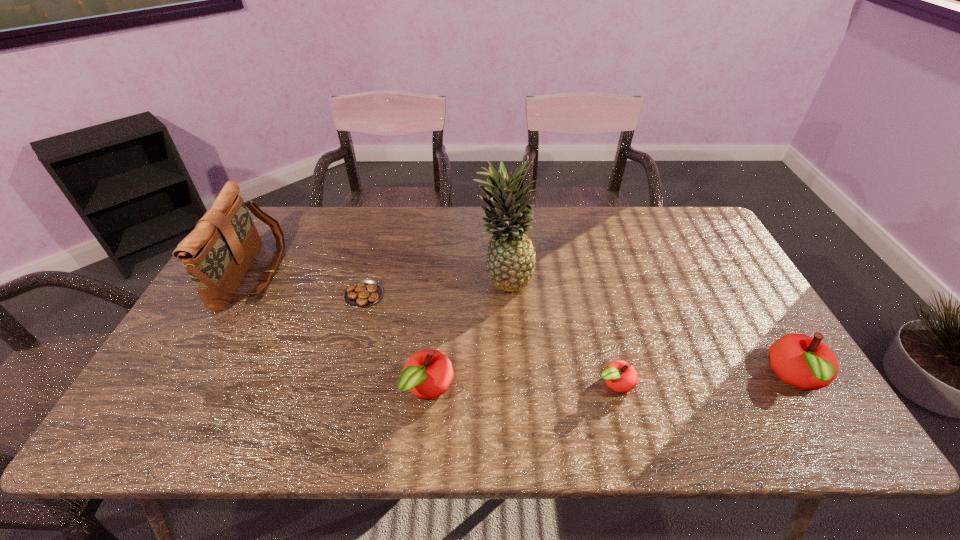
Observe the arrangement of all apples in the image. To keep them evenly spaced, where would you place another apple on the left? Please locate a free space. Please provide its 2D coordinates. Your answer should be formatted as a tuple, i.e. [(x, y)], where the tuple contains the x and y coordinates of a point satisfying the conditions above.

[(240, 393)]